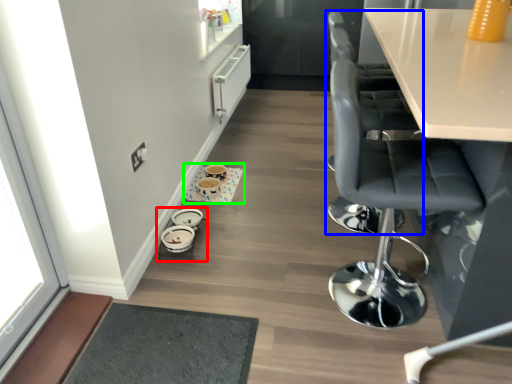
Question: Which object is the closest to the round table (highlighted by a red box)? Choose among these: chair (highlighted by a blue box) or round table (highlighted by a green box).

Choices:
 (A) chair
 (B) round table

Answer: (B)